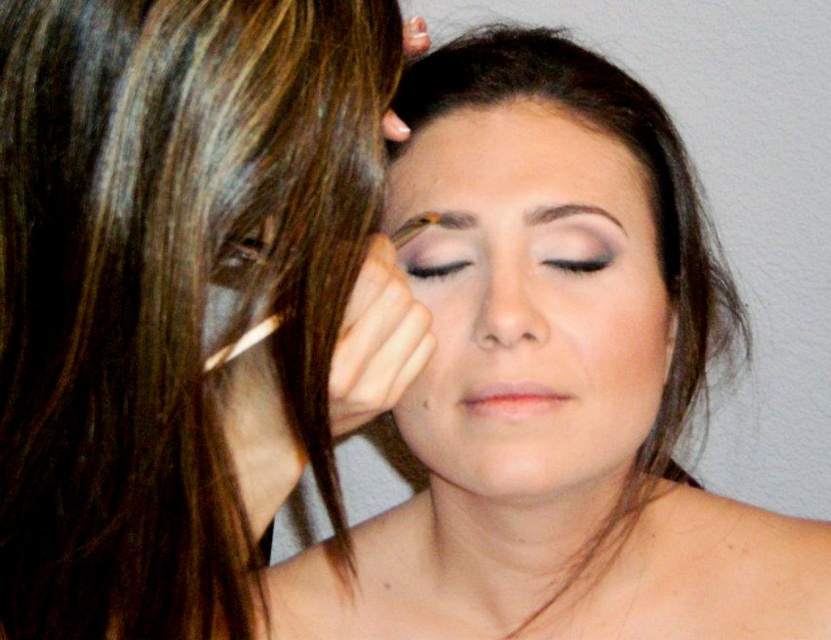
Question: Based on their relative distances, which object is farther from the matte brown eyebrow at upper center?

Choices:
 (A) brown matte eyebrow at upper center
 (B) brown hair at upper left

Answer: (B)

Question: Is smooth skin at center smaller than matte brown eyebrow at upper left?

Choices:
 (A) yes
 (B) no

Answer: (B)

Question: Which object appears closest to the camera in this image?

Choices:
 (A) brown hair at upper left
 (B) matte brown eye at upper center
 (C) brown matte eyebrow at upper center
 (D) matte black eyeliner at center

Answer: (A)

Question: Can you confirm if matte purple eyeshadow at center is thinner than matte brown eye at upper center?

Choices:
 (A) yes
 (B) no

Answer: (B)

Question: Which point appears closest to the camera in this image?

Choices:
 (A) click(x=569, y=204)
 (B) click(x=583, y=230)

Answer: (A)

Question: Can you confirm if matte skin tone face at center is positioned to the left of matte brown eyebrow at upper center?

Choices:
 (A) yes
 (B) no

Answer: (B)